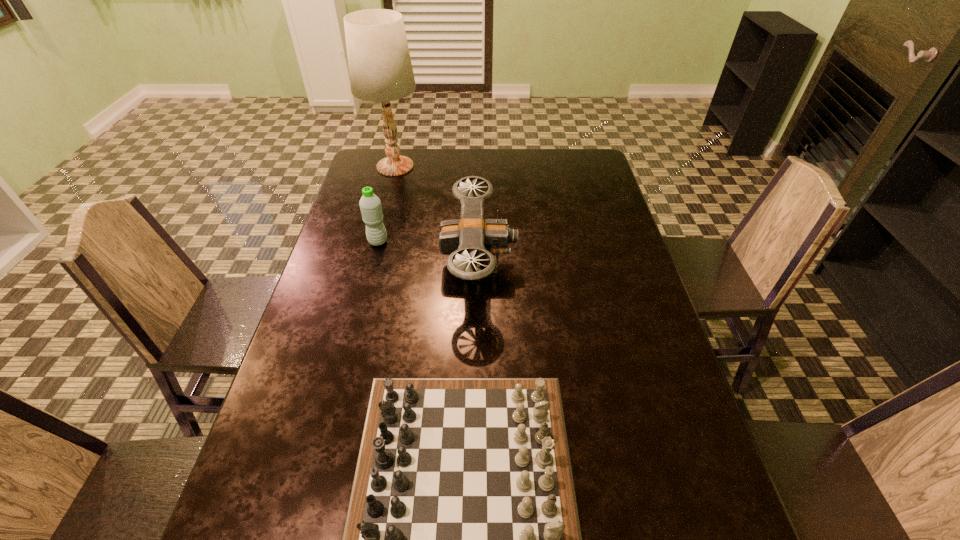
Locate an element on the screen. object at the far left corner is located at coordinates (380, 69).

In the image, there is a desktop. At what (x,y) coordinates should I click in order to perform the action: click on vacant space at the far edge. Please return your answer as a coordinate pair (x, y). This screenshot has height=540, width=960. Looking at the image, I should click on (419, 174).

The image size is (960, 540). Identify the location of free spot at the left edge of the desktop. (353, 186).

This screenshot has width=960, height=540. In the image, there is a desktop. Find the location of `vacant space at the right edge`. vacant space at the right edge is located at coordinates (x=628, y=307).

Locate an element on the screen. vacant space at the far left corner of the desktop is located at coordinates (360, 174).

You are a GUI agent. You are given a task and a screenshot of the screen. Output one action in this format:
    pyautogui.click(x=<x>, y=<y>)
    Task: Click on the vacant area that lies between the drone and the farthest object
    Image resolution: width=960 pixels, height=540 pixels.
    Given the screenshot: What is the action you would take?
    pyautogui.click(x=437, y=214)

Find the location of `vacant area between the water bottle and the farthest object`. vacant area between the water bottle and the farthest object is located at coordinates (387, 204).

Identify the location of unoccupied position between the water bottle and the tallest object. (387, 204).

At what (x,y) coordinates should I click in order to perform the action: click on blank region between the lamp and the drone. Please return your answer as a coordinate pair (x, y). Looking at the image, I should click on (437, 214).

At what (x,y) coordinates should I click in order to perform the action: click on free space between the water bottle and the tallest object. Please return your answer as a coordinate pair (x, y). The height and width of the screenshot is (540, 960). Looking at the image, I should click on (387, 204).